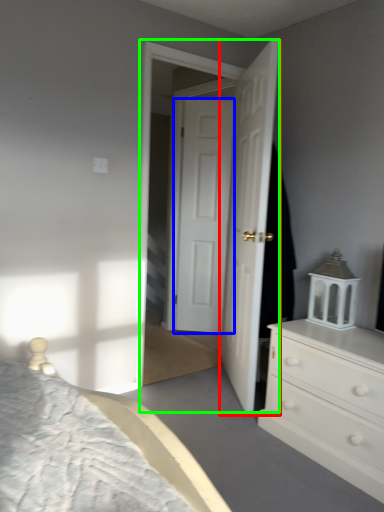
Question: Considering the real-world distances, which object is closest to door (highlighted by a red box)? door (highlighted by a blue box) or screen door (highlighted by a green box).

Choices:
 (A) door
 (B) screen door

Answer: (B)